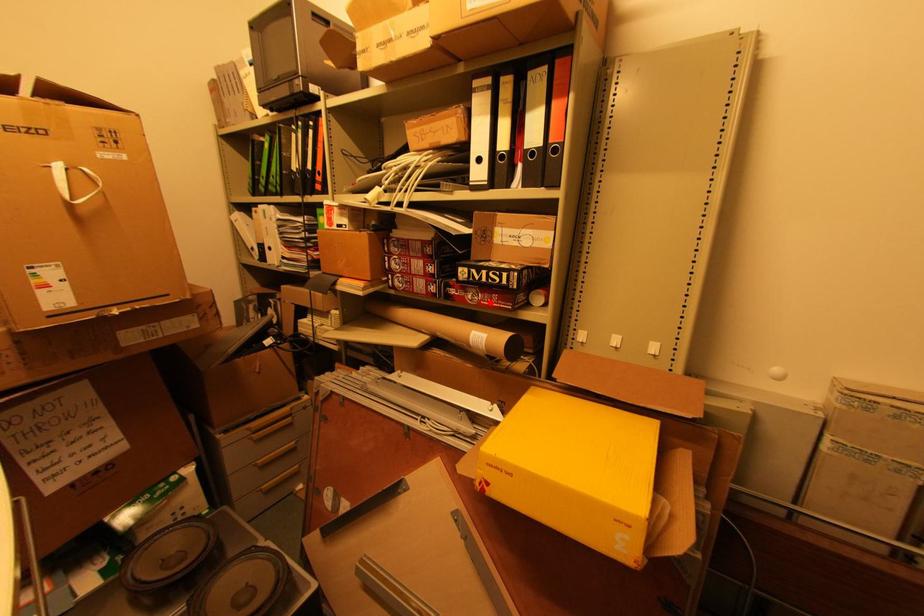
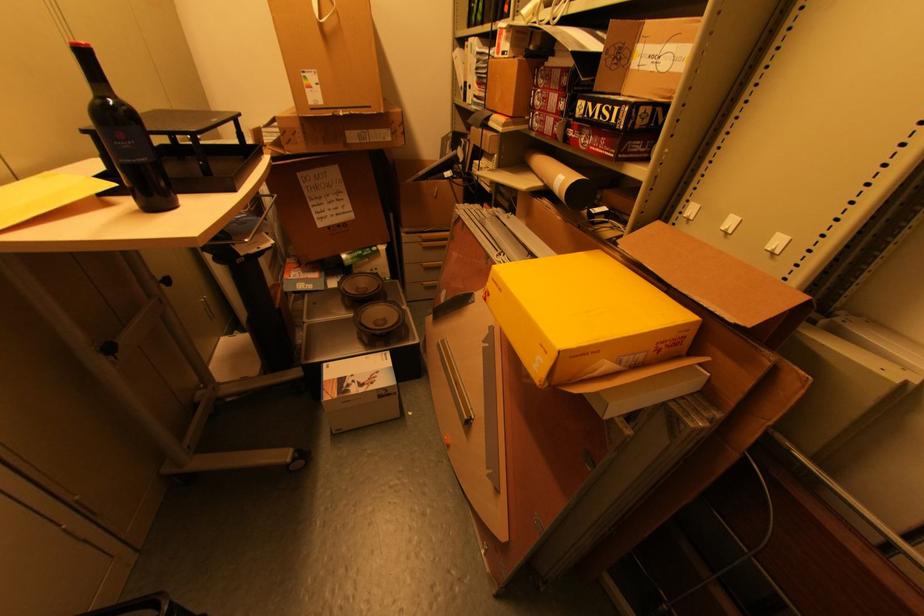
Where in the second image is the point corresponding to the highlighted location from the first image?

(599, 148)